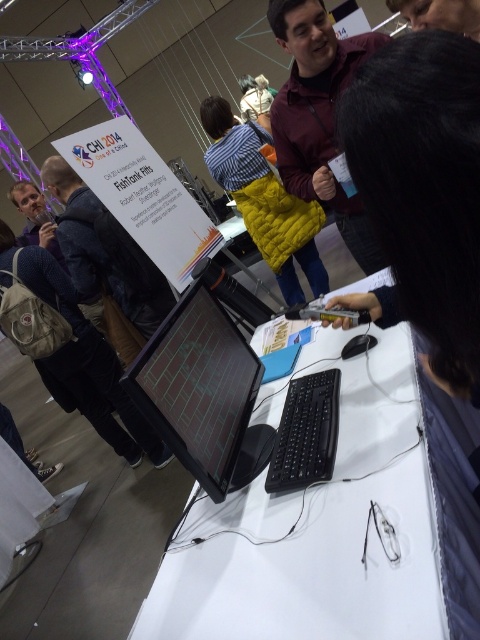
You are organizing a small event and need to place a 6.5 feet long banner between the black hair at upper center and the matte black backpack at lower left. Will there be enough space to fit it without bending the banner?

The distance between the black hair at upper center and the matte black backpack at lower left is 7.82 feet, which is longer than the 6.5 feet banner. Therefore, there is sufficient space to place the banner straight without bending it.

You are an attendee at the event and want to take a photo of the black glossy monitor at center without the black hair at upper center blocking the view. Is the monitor taller than the hair?

The black hair at upper center is shorter than the black glossy monitor at center, so the monitor is taller. Therefore, you can take a photo of the black glossy monitor at center without the black hair at upper center blocking the view.

You are standing at the entrance of the conference hall and want to reach the point marked at coordinates point (395,93). If your stride length is 24 inches, how many steps would it take you to reach that point?

The distance between you and point (395,93) is 16.79 inches. Since each step covers 24 inches, dividing 16.79 by 24 gives approximately 0.7 steps. Therefore, you would need to take 1 step to reach point (395,93).